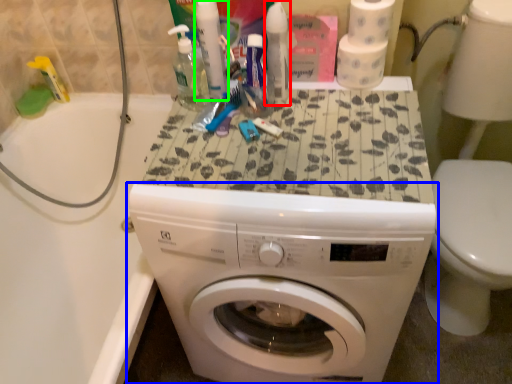
Question: Based on their relative distances, which object is nearer to cleaning product (highlighted by a red box)? Choose from washing machine (highlighted by a blue box) and toiletry (highlighted by a green box).

Choices:
 (A) washing machine
 (B) toiletry

Answer: (B)